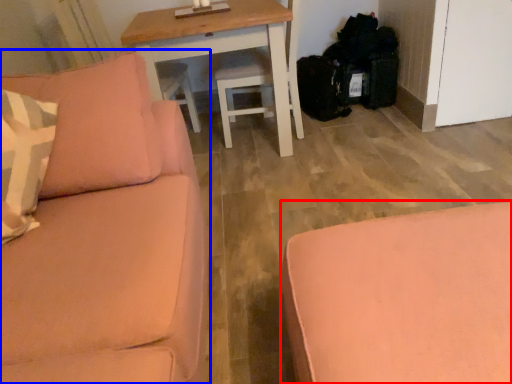
Question: Which object is closer to the camera taking this photo, studio couch (highlighted by a red box) or studio couch (highlighted by a blue box)?

Choices:
 (A) studio couch
 (B) studio couch

Answer: (B)